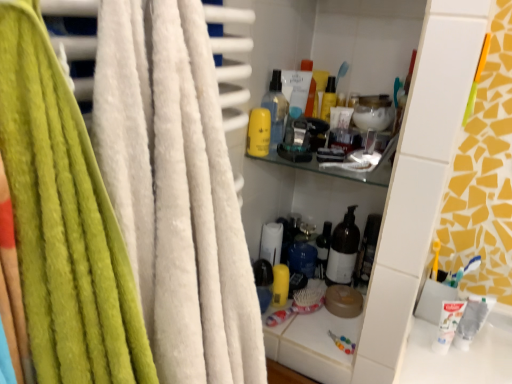
The image size is (512, 384). What do you see at coordinates (447, 325) in the screenshot? I see `white matte toothpaste at lower right` at bounding box center [447, 325].

In order to click on translucent glass bottle at center, marked as the first bottle in a back-to-front arrangement in this screenshot , I will do `click(367, 249)`.

This screenshot has width=512, height=384. Describe the element at coordinates (258, 132) in the screenshot. I see `yellow matte lotion at upper center` at that location.

Find the location of a particular element. white matte toothpaste at lower right is located at coordinates (447, 325).

Is yellow matte lotion at upper center oriented towards translucent plastic spray bottle at upper center, which is counted as the first bottle, starting from the front?

No, yellow matte lotion at upper center is not turned towards translucent plastic spray bottle at upper center, which is counted as the first bottle, starting from the front.

In the scene shown: Considering the sizes of objects yellow matte lotion at upper center and translucent plastic spray bottle at upper center, which is counted as the first bottle, starting from the front, in the image provided, who is shorter, yellow matte lotion at upper center or translucent plastic spray bottle at upper center, which is counted as the first bottle, starting from the front,?

With less height is yellow matte lotion at upper center.

The height and width of the screenshot is (384, 512). What are the coordinates of `bottle that appears above the yellow matte lotion at upper center (from the image's perspective)` in the screenshot? It's located at (276, 107).

From a real-world perspective, is translucent glass bottle at center, which appears as the first bottle when viewed from the right, on top of blue plastic toothbrush at lower right?

No, from a real-world perspective, translucent glass bottle at center, which appears as the first bottle when viewed from the right, is not over blue plastic toothbrush at lower right

Is translucent glass bottle at center, which is the second bottle in front-to-back order, at the left side of blue plastic toothbrush at lower right?

Yes.

Is point (370, 226) positioned in front of point (459, 279)?

No, (370, 226) is further to viewer.

Considering the positions of objects blue plastic toothbrush at lower right and white matte toothpaste at lower right in the image provided, who is more to the left, blue plastic toothbrush at lower right or white matte toothpaste at lower right?

From the viewer's perspective, white matte toothpaste at lower right appears more on the left side.

Is there a large distance between blue plastic toothbrush at lower right and white matte toothpaste at lower right?

No, there isn't a large distance between blue plastic toothbrush at lower right and white matte toothpaste at lower right.

Is blue plastic toothbrush at lower right not within white matte toothpaste at lower right?

Yes, blue plastic toothbrush at lower right is located beyond the bounds of white matte toothpaste at lower right.

Is blue plastic toothbrush at lower right positioned beyond the bounds of translucent glass bottle at center, the 1th bottle ordered from the bottom?

blue plastic toothbrush at lower right is positioned outside translucent glass bottle at center, the 1th bottle ordered from the bottom.

Would you consider blue plastic toothbrush at lower right to be distant from translucent glass bottle at center, marked as the first bottle in a back-to-front arrangement?

No, there isn't a large distance between blue plastic toothbrush at lower right and translucent glass bottle at center, marked as the first bottle in a back-to-front arrangement.

Is blue plastic toothbrush at lower right facing towards translucent glass bottle at center, which is the second bottle in front-to-back order?

No, blue plastic toothbrush at lower right does not turn towards translucent glass bottle at center, which is the second bottle in front-to-back order.

Which is in front, point (251, 126) or point (464, 309)?

The point (251, 126) is more forward.

Which object is further away from the camera, yellow matte lotion at upper center or white matte toothpaste at lower right?

white matte toothpaste at lower right is more distant.

Based on their sizes in the image, would you say yellow matte lotion at upper center is bigger or smaller than white matte toothpaste at lower right?

yellow matte lotion at upper center is smaller than white matte toothpaste at lower right.

From a real-world perspective, is yellow matte lotion at upper center beneath white matte toothpaste at lower right?

No, from a real-world perspective, yellow matte lotion at upper center is not below white matte toothpaste at lower right.

In the scene shown: From a real-world perspective, is translucent plastic spray bottle at upper center, which ranks as the 1th bottle in left-to-right order, above or below white matte toothpaste at lower right?

Clearly, from a real-world perspective, translucent plastic spray bottle at upper center, which ranks as the 1th bottle in left-to-right order, is above white matte toothpaste at lower right.

Is translucent plastic spray bottle at upper center, which is the second bottle from back to front, in contact with white matte toothpaste at lower right?

No, translucent plastic spray bottle at upper center, which is the second bottle from back to front, is not in contact with white matte toothpaste at lower right.

Is point (288, 103) positioned before point (440, 313)?

Yes, it is.

Which is closer to the camera, (x=361, y=248) or (x=453, y=330)?

Point (x=361, y=248).

Considering the positions of objects translucent glass bottle at center, the second bottle from the left, and white matte toothpaste at lower right in the image provided, who is more to the right, translucent glass bottle at center, the second bottle from the left, or white matte toothpaste at lower right?

white matte toothpaste at lower right.

Is translucent glass bottle at center, which is the second bottle in front-to-back order, closer to the viewer compared to white matte toothpaste at lower right?

No, it is behind white matte toothpaste at lower right.

Image resolution: width=512 pixels, height=384 pixels. Find the location of `toiletry on the left of translucent plastic spray bottle at upper center, acting as the 2th bottle starting from the bottom`. toiletry on the left of translucent plastic spray bottle at upper center, acting as the 2th bottle starting from the bottom is located at coordinates (258, 132).

The width and height of the screenshot is (512, 384). I want to click on the 1st bottle above the blue plastic toothbrush at lower right (from the image's perspective), so click(367, 249).

Estimate the real-world distances between objects in this image. Which object is closer to blue plastic toothbrush at lower right, translucent plastic spray bottle at upper center, which ranks as the second bottle in right-to-left order, or white matte toothpaste at lower right?

white matte toothpaste at lower right lies closer to blue plastic toothbrush at lower right than the other object.

Considering their positions, is yellow matte lotion at upper center positioned further to white matte toothpaste at lower right than translucent plastic spray bottle at upper center, which ranks as the second bottle in right-to-left order?

The object further to white matte toothpaste at lower right is translucent plastic spray bottle at upper center, which ranks as the second bottle in right-to-left order.

Based on their spatial positions, is translucent glass bottle at center, positioned as the second bottle in top-to-bottom order, or white matte toothpaste at lower right further from yellow matte lotion at upper center?

white matte toothpaste at lower right lies further to yellow matte lotion at upper center than the other object.

When comparing their distances from white matte toothpaste at lower right, does translucent plastic spray bottle at upper center, acting as the 2th bottle starting from the bottom, or blue plastic toothbrush at lower right seem closer?

blue plastic toothbrush at lower right is closer to white matte toothpaste at lower right.

Looking at the image, which one is located further to yellow matte lotion at upper center, white matte toothpaste at lower right or translucent plastic spray bottle at upper center, which ranks as the second bottle in right-to-left order?

white matte toothpaste at lower right is further to yellow matte lotion at upper center.

From the image, which object appears to be farther from yellow matte lotion at upper center, white matte toothpaste at lower right or translucent glass bottle at center, which is the second bottle in front-to-back order?

white matte toothpaste at lower right.

Considering their positions, is white matte toothpaste at lower right positioned closer to translucent glass bottle at center, marked as the first bottle in a back-to-front arrangement, than yellow matte lotion at upper center?

Among the two, white matte toothpaste at lower right is located nearer to translucent glass bottle at center, marked as the first bottle in a back-to-front arrangement.

Estimate the real-world distances between objects in this image. Which object is closer to blue plastic toothbrush at lower right, translucent glass bottle at center, the second bottle from the left, or yellow matte lotion at upper center?

Based on the image, translucent glass bottle at center, the second bottle from the left, appears to be nearer to blue plastic toothbrush at lower right.

Locate an element on the screen. This screenshot has width=512, height=384. toothpaste between translucent plastic spray bottle at upper center, the 1th bottle positioned from the top, and blue plastic toothbrush at lower right from left to right is located at coordinates (447, 325).

What are the coordinates of `bottle between yellow matte lotion at upper center and white matte toothpaste at lower right in the vertical direction` in the screenshot? It's located at (367, 249).

Where is `toothpaste between translucent glass bottle at center, the 1th bottle ordered from the bottom, and blue plastic toothbrush at lower right, in the horizontal direction`? This screenshot has width=512, height=384. toothpaste between translucent glass bottle at center, the 1th bottle ordered from the bottom, and blue plastic toothbrush at lower right, in the horizontal direction is located at coordinates (447, 325).

Image resolution: width=512 pixels, height=384 pixels. Find the location of `toiletry that lies between translucent plastic spray bottle at upper center, which is the second bottle from back to front, and translucent glass bottle at center, the 1th bottle ordered from the bottom, from top to bottom`. toiletry that lies between translucent plastic spray bottle at upper center, which is the second bottle from back to front, and translucent glass bottle at center, the 1th bottle ordered from the bottom, from top to bottom is located at coordinates (258, 132).